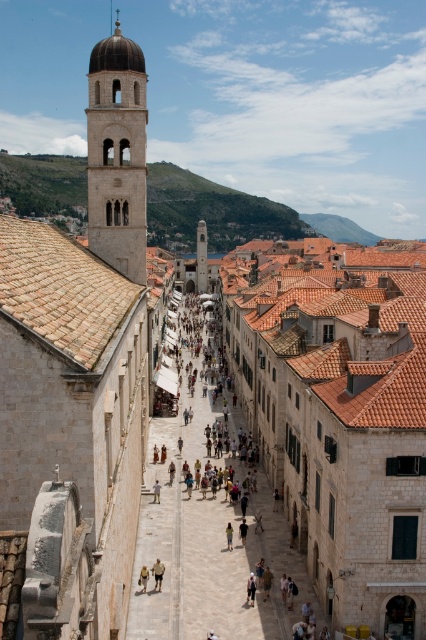
Which is below, light beige stone bell tower at upper left or light beige shorts at center?

Positioned lower is light beige shorts at center.

Which is behind, point (109, 125) or point (144, 582)?

Positioned behind is point (109, 125).

Is point (123, 51) positioned after point (141, 579)?

Yes, point (123, 51) is behind point (141, 579).

Identify the location of light beige stone bell tower at upper left. This screenshot has height=640, width=426. (118, 154).

Is light brown leather pants at center closer to camera compared to light brown fabric at center?

That is True.

Is light brown leather pants at center to the right of light brown fabric at center from the viewer's perspective?

Incorrect, light brown leather pants at center is not on the right side of light brown fabric at center.

Is point (161, 572) farther from viewer compared to point (226, 532)?

No, it is not.

Locate an element on the screen. This screenshot has height=640, width=426. light brown leather pants at center is located at coordinates (158, 572).

Can you confirm if light beige stone alley at center is positioned above light beige shorts at center?

Indeed, light beige stone alley at center is positioned over light beige shorts at center.

Is light beige stone alley at center wider than light beige shorts at center?

Yes, light beige stone alley at center is wider than light beige shorts at center.

Which is behind, point (181, 524) or point (143, 576)?

The point (181, 524) is more distant.

Locate an element on the screen. The height and width of the screenshot is (640, 426). light beige stone alley at center is located at coordinates (203, 545).